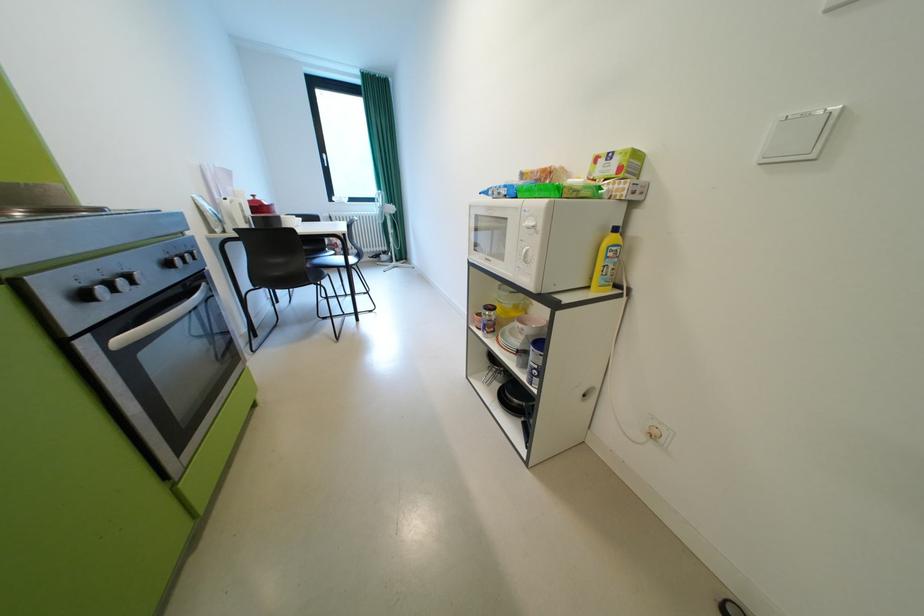
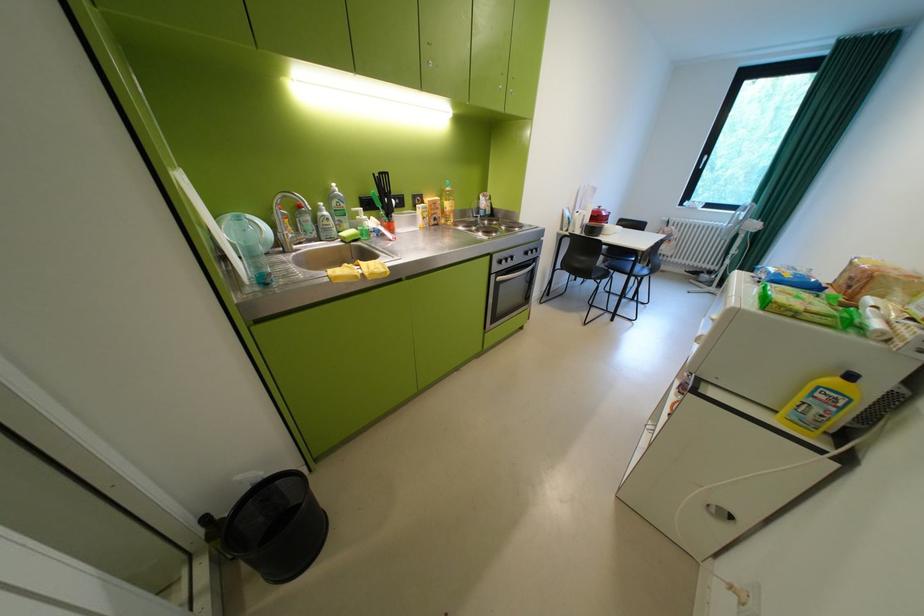
Where in the second image is the point corresponding to point 222,232 from the first image?

(572, 230)